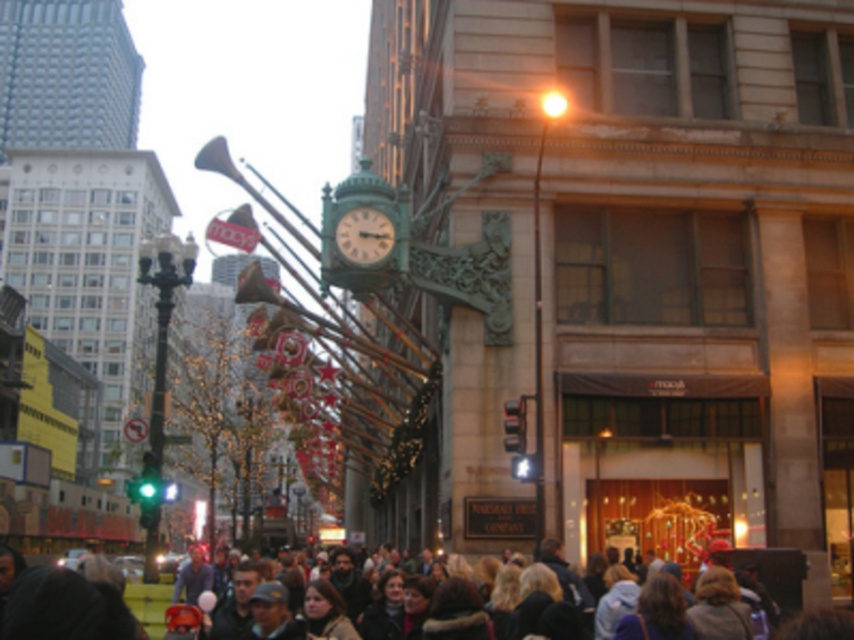
You are a city planner analyzing the street layout. You need to install a new streetlight that must be placed closer to the black metal pole at left than to the green painted metal clock at center. Where should the new streetlight be positioned?

The new streetlight should be placed closer to the black metal pole at left than to the green painted metal clock at center, as the pole is larger in size and likely a more prominent landmark for positioning.

You are a delivery person trying to navigate through the crowd to reach the green painted metal clock at center. There is a black metal pole at left blocking your path. Can you walk around it easily?

The black metal pole at left is further to the viewer than the green painted metal clock at center, meaning the pole is closer to you. Since the pole is closer, you can walk around it to reach the clock.

You are a photographer standing at the edge of the crowd in the bustling urban street scene. You want to capture both the dark brown hair at lower center and the green painted metal clock at center in a single shot. Which object should you focus on first to ensure both are in frame?

The dark brown hair at lower center is taller than the green painted metal clock at center, so focusing on the dark brown hair at lower center first will help ensure both are in frame.